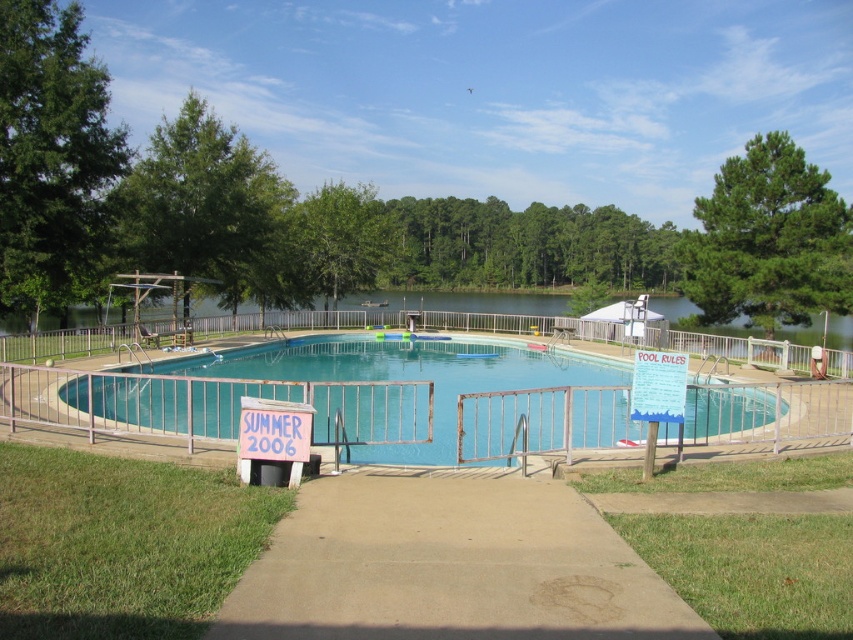
Who is more forward, (289,234) or (642,356)?

Point (642,356) is in front.

Is green leafy tree at center shorter than white paper sign at upper right?

No.

Does point (358, 262) come in front of point (647, 362)?

No, it is behind (647, 362).

Identify the location of green leafy tree at center. The height and width of the screenshot is (640, 853). 331,244.

Does green leafy tree at left have a lesser width compared to green pine tree at upper right?

Yes, green leafy tree at left is thinner than green pine tree at upper right.

Is green leafy tree at left further to the viewer compared to green pine tree at upper right?

Answer: No.

Between point (99, 97) and point (746, 172), which one is positioned in front?

Point (99, 97)

Locate an element on the screen. green leafy tree at left is located at coordinates (51, 157).

Can you confirm if green pine tree at upper right is wider than white paper sign at upper right?

Correct, the width of green pine tree at upper right exceeds that of white paper sign at upper right.

Who is positioned more to the left, green pine tree at upper right or white paper sign at upper right?

Positioned to the left is white paper sign at upper right.

Locate an element on the screen. The image size is (853, 640). green pine tree at upper right is located at coordinates (769, 240).

I want to click on green pine tree at upper right, so click(x=769, y=240).